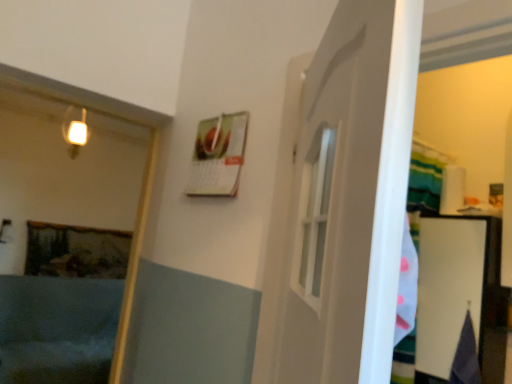
Question: From a real-world perspective, does matte blue bathtub at lower left sit lower than matte white light fixture at upper left?

Choices:
 (A) yes
 (B) no

Answer: (A)

Question: Is matte blue bathtub at lower left shorter than matte white light fixture at upper left?

Choices:
 (A) yes
 (B) no

Answer: (B)

Question: Is matte blue bathtub at lower left oriented towards matte white light fixture at upper left?

Choices:
 (A) no
 (B) yes

Answer: (A)

Question: Is matte blue bathtub at lower left next to matte white light fixture at upper left?

Choices:
 (A) yes
 (B) no

Answer: (B)

Question: Are matte blue bathtub at lower left and matte white light fixture at upper left far apart?

Choices:
 (A) no
 (B) yes

Answer: (B)

Question: Can you confirm if matte blue bathtub at lower left is positioned to the right of matte white light fixture at upper left?

Choices:
 (A) yes
 (B) no

Answer: (B)

Question: Is matte blue bathtub at lower left a part of matte white light fixture at upper left?

Choices:
 (A) yes
 (B) no

Answer: (B)

Question: From a real-world perspective, is matte white light fixture at upper left located beneath matte blue bathtub at lower left?

Choices:
 (A) no
 (B) yes

Answer: (A)

Question: Considering the relative positions of matte white light fixture at upper left and matte blue bathtub at lower left in the image provided, is matte white light fixture at upper left behind matte blue bathtub at lower left?

Choices:
 (A) yes
 (B) no

Answer: (A)

Question: From the image's perspective, is matte white light fixture at upper left under matte blue bathtub at lower left?

Choices:
 (A) yes
 (B) no

Answer: (B)

Question: Is matte white light fixture at upper left taller than matte blue bathtub at lower left?

Choices:
 (A) yes
 (B) no

Answer: (B)

Question: Considering the relative sizes of matte white light fixture at upper left and matte blue bathtub at lower left in the image provided, is matte white light fixture at upper left bigger than matte blue bathtub at lower left?

Choices:
 (A) no
 (B) yes

Answer: (A)

Question: In terms of size, does matte white light fixture at upper left appear bigger or smaller than matte blue bathtub at lower left?

Choices:
 (A) big
 (B) small

Answer: (B)